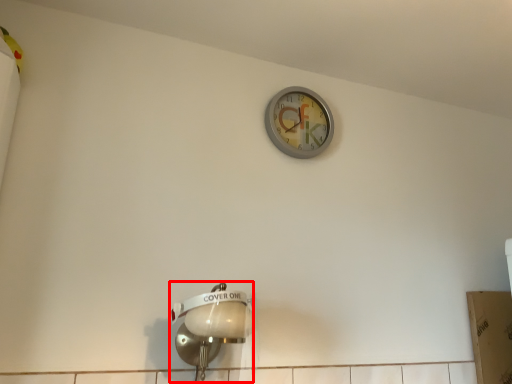
Question: From the image, what is the correct spatial relationship of light fixture (annotated by the red box) in relation to wall clock?

Choices:
 (A) right
 (B) left

Answer: (B)